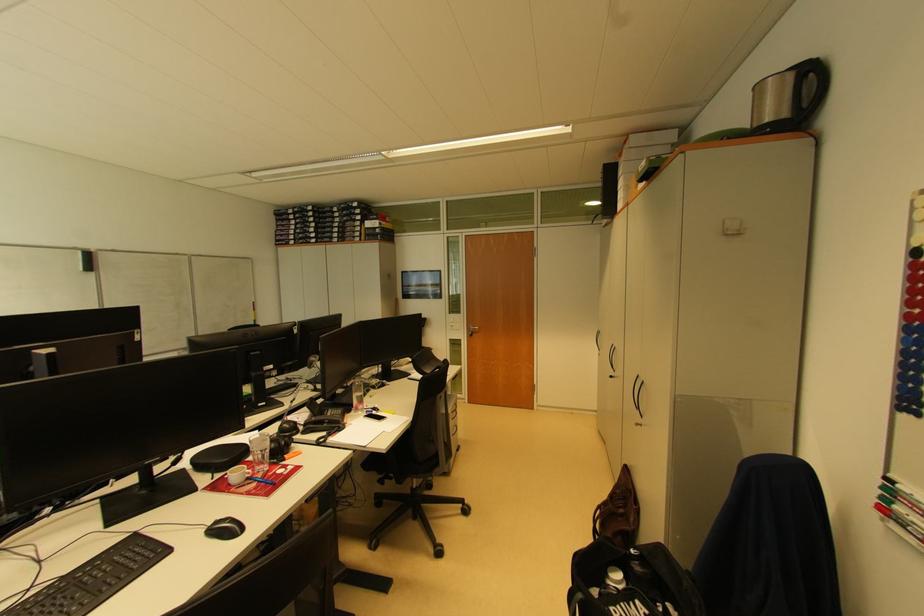
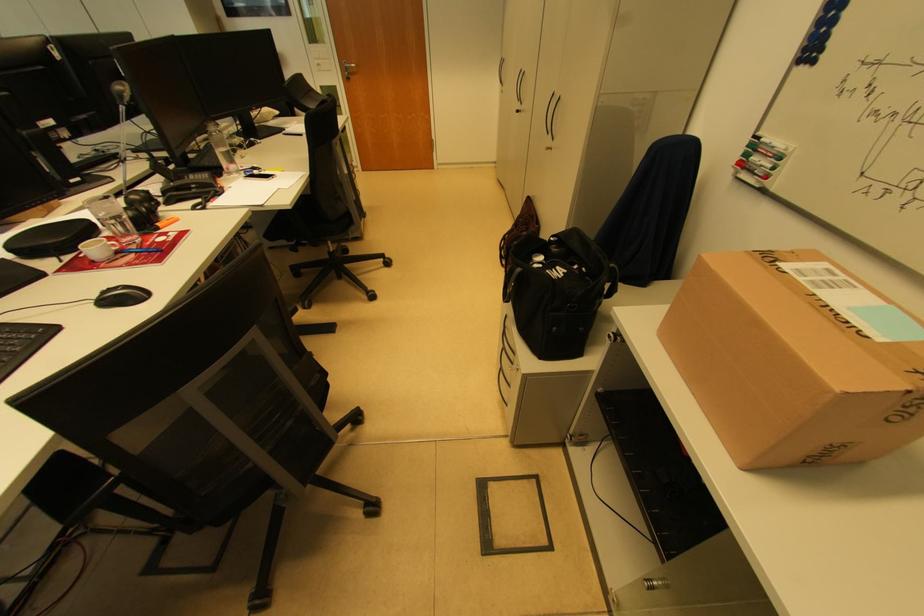
Find the pixel in the second image that matches the point at 614,377 in the first image.

(520, 110)